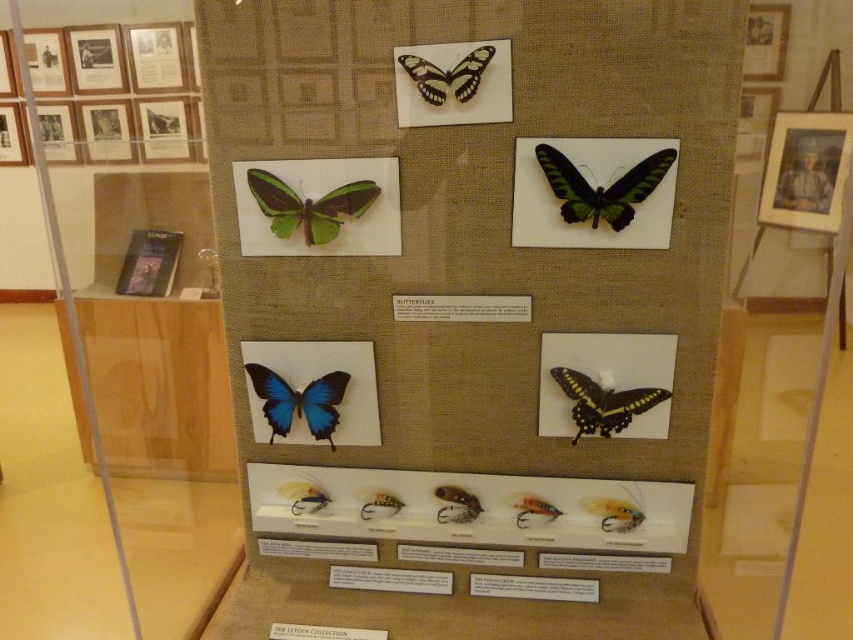
Question: Is blue glossy butterfly at center wider than yellow-green iridescent butterfly at lower right?

Choices:
 (A) yes
 (B) no

Answer: (B)

Question: Does blue glossy butterfly at center appear on the left side of yellow-green iridescent butterfly at lower right?

Choices:
 (A) no
 (B) yes

Answer: (B)

Question: Does green matte butterfly at upper center have a greater width compared to translucent yellow-green butterfly at center?

Choices:
 (A) yes
 (B) no

Answer: (A)

Question: Which point is closer to the camera?

Choices:
 (A) translucent yellow-green butterfly at center
 (B) yellow-green iridescent butterfly at lower right
 (C) translucent orange fly at center

Answer: (B)

Question: Based on their relative distances, which object is farther from the translucent yellow-green butterfly at center?

Choices:
 (A) green matte butterfly at upper center
 (B) yellow-green iridescent butterfly at lower right
 (C) blue glossy butterfly at center

Answer: (A)

Question: Among these objects, which one is nearest to the camera?

Choices:
 (A) yellow-green iridescent butterfly at lower right
 (B) green matte butterfly at upper right
 (C) green matte butterfly at upper center
 (D) blue glossy butterfly at center

Answer: (B)